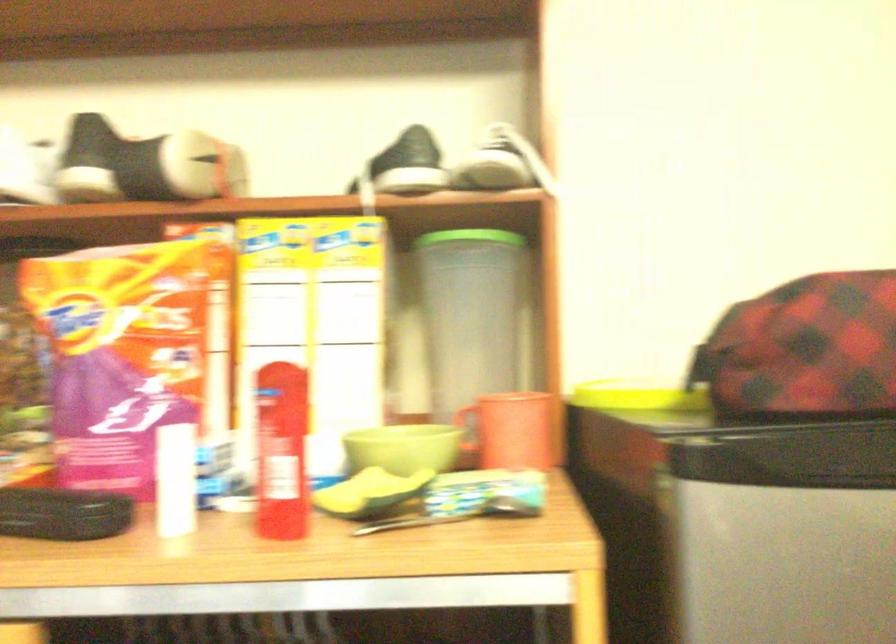
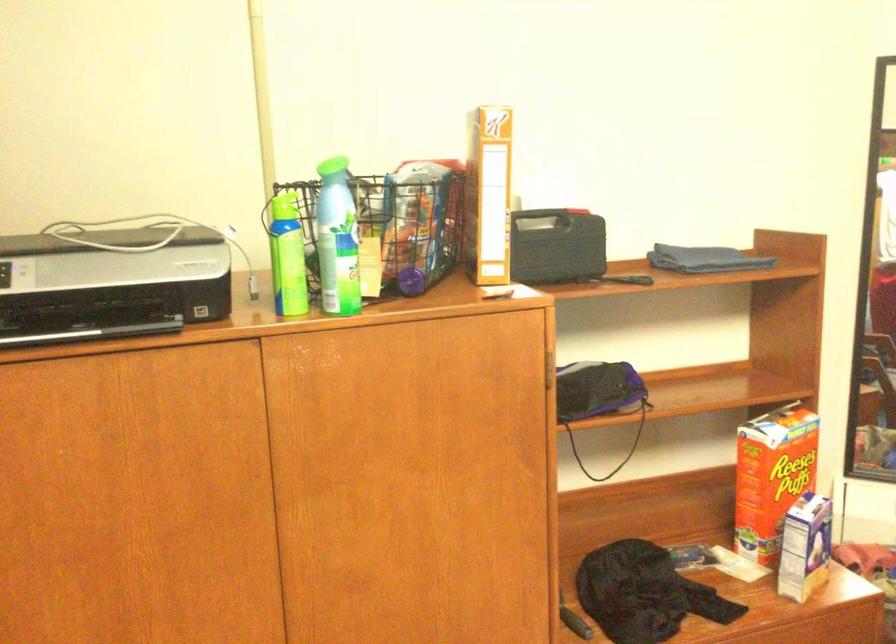
Question: The first image is from the beginning of the video and the second image is from the end. How did the camera likely rotate when shooting the video?

Choices:
 (A) Left
 (B) Right
 (C) Up
 (D) Down

Answer: (B)